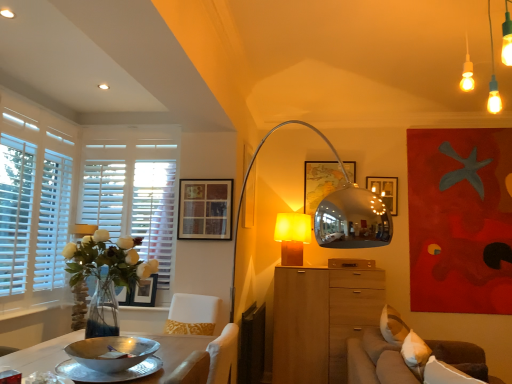
Question: From the image's perspective, would you say silver metallic bowl at lower left is shown under brown fabric couch at lower right?

Choices:
 (A) yes
 (B) no

Answer: (B)

Question: Is silver metallic bowl at lower left located outside brown fabric couch at lower right?

Choices:
 (A) no
 (B) yes

Answer: (B)

Question: From the image's perspective, is silver metallic bowl at lower left on top of brown fabric couch at lower right?

Choices:
 (A) yes
 (B) no

Answer: (A)

Question: Can you confirm if silver metallic bowl at lower left is positioned to the left of brown fabric couch at lower right?

Choices:
 (A) yes
 (B) no

Answer: (A)

Question: Does silver metallic bowl at lower left have a greater height compared to brown fabric couch at lower right?

Choices:
 (A) yes
 (B) no

Answer: (B)

Question: In terms of size, does wooden picture frame at upper center, the second picture frame from the top, appear bigger or smaller than wooden drawer at center?

Choices:
 (A) small
 (B) big

Answer: (A)

Question: Relative to wooden drawer at center, is wooden picture frame at upper center, which is the 2th picture frame from bottom to top, in front or behind?

Choices:
 (A) front
 (B) behind

Answer: (A)

Question: Visually, is wooden picture frame at upper center, which is the second picture frame from right to left, positioned to the left or to the right of wooden drawer at center?

Choices:
 (A) right
 (B) left

Answer: (B)

Question: Considering the positions of wooden picture frame at upper center, which is the second picture frame from right to left, and wooden drawer at center in the image, is wooden picture frame at upper center, which is the second picture frame from right to left, wider or thinner than wooden drawer at center?

Choices:
 (A) wide
 (B) thin

Answer: (B)

Question: Is white wooden blinds at left wider or thinner than matte white pendant lights at upper right?

Choices:
 (A) thin
 (B) wide

Answer: (A)

Question: Choose the correct answer: Is white wooden blinds at left inside matte white pendant lights at upper right or outside it?

Choices:
 (A) outside
 (B) inside

Answer: (A)

Question: In terms of size, does white wooden blinds at left appear bigger or smaller than matte white pendant lights at upper right?

Choices:
 (A) big
 (B) small

Answer: (B)

Question: Does point (46, 178) appear closer or farther from the camera than point (501, 105)?

Choices:
 (A) closer
 (B) farther

Answer: (A)

Question: Based on their positions, is matte black picture frame at upper center, which is the first picture frame from left to right, located to the left or right of white wooden blinds at left?

Choices:
 (A) right
 (B) left

Answer: (A)

Question: Do you think matte black picture frame at upper center, marked as the 2th picture frame in a front-to-back arrangement, is within white wooden blinds at left, or outside of it?

Choices:
 (A) inside
 (B) outside

Answer: (B)